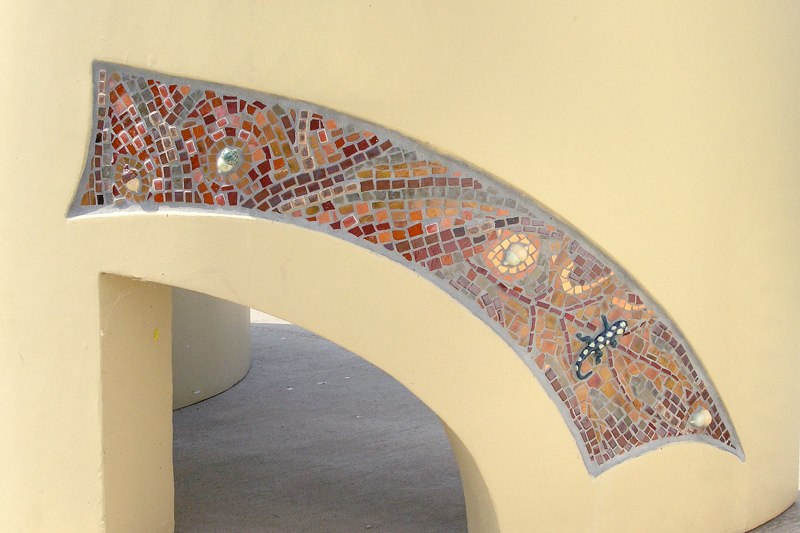
Find the location of `cement floor`. cement floor is located at coordinates (316, 408).